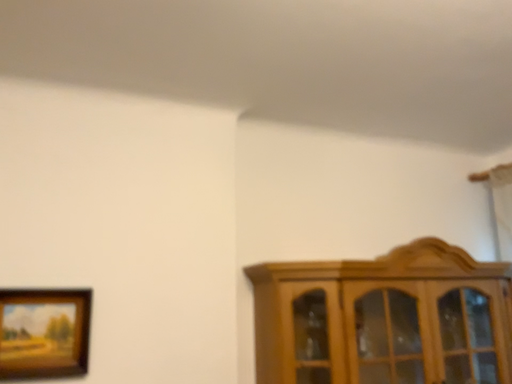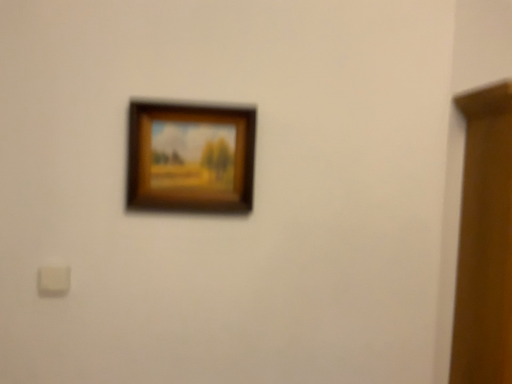
Question: How did the camera likely rotate when shooting the video?

Choices:
 (A) rotated downward
 (B) rotated upward

Answer: (A)